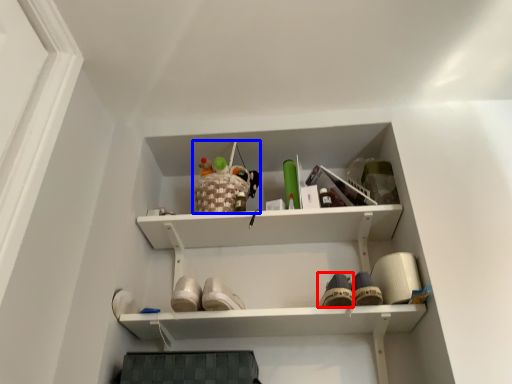
Question: Among these objects, which one is farthest to the camera, shoe (highlighted by a red box) or toy (highlighted by a blue box)?

Choices:
 (A) shoe
 (B) toy

Answer: (B)